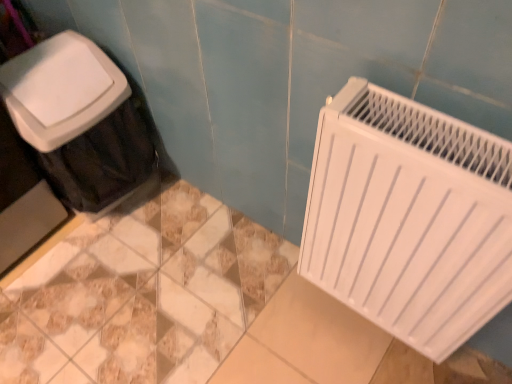
Question: Would you say white matte radiator at right is to the left or to the right of white plastic trash can at left in the picture?

Choices:
 (A) right
 (B) left

Answer: (A)

Question: Do you think white matte radiator at right is within white plastic trash can at left, or outside of it?

Choices:
 (A) outside
 (B) inside

Answer: (A)

Question: Is white matte radiator at right in front of or behind white plastic trash can at left in the image?

Choices:
 (A) behind
 (B) front

Answer: (B)

Question: In terms of height, does white plastic trash can at left look taller or shorter compared to white matte radiator at right?

Choices:
 (A) short
 (B) tall

Answer: (B)

Question: Considering the positions of white plastic trash can at left and white matte radiator at right in the image, is white plastic trash can at left wider or thinner than white matte radiator at right?

Choices:
 (A) wide
 (B) thin

Answer: (A)

Question: Considering their positions, is white plastic trash can at left located in front of or behind white matte radiator at right?

Choices:
 (A) front
 (B) behind

Answer: (B)

Question: From a real-world perspective, relative to white matte radiator at right, is white plastic trash can at left vertically above or below?

Choices:
 (A) below
 (B) above

Answer: (A)